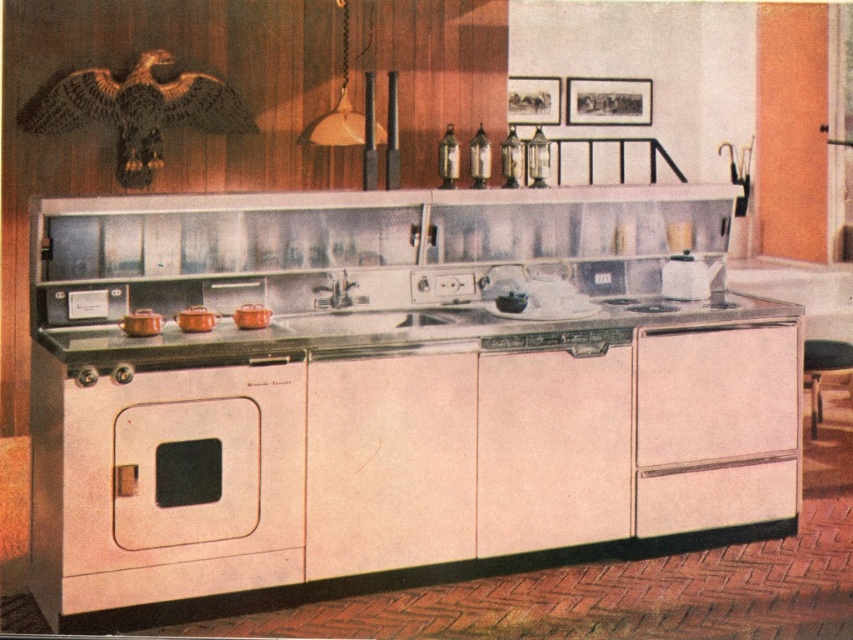
Question: Does metallic silver counter top at center appear on the left side of golden metallic eagle at upper left?

Choices:
 (A) yes
 (B) no

Answer: (B)

Question: Which point is closer to the camera taking this photo?

Choices:
 (A) (460, 336)
 (B) (36, 99)

Answer: (A)

Question: Which object appears farthest from the camera in this image?

Choices:
 (A) golden metallic eagle at upper left
 (B) metallic silver counter top at center

Answer: (A)

Question: Is metallic silver counter top at center closer to camera compared to golden metallic eagle at upper left?

Choices:
 (A) yes
 (B) no

Answer: (A)

Question: Does metallic silver counter top at center appear on the right side of golden metallic eagle at upper left?

Choices:
 (A) no
 (B) yes

Answer: (B)